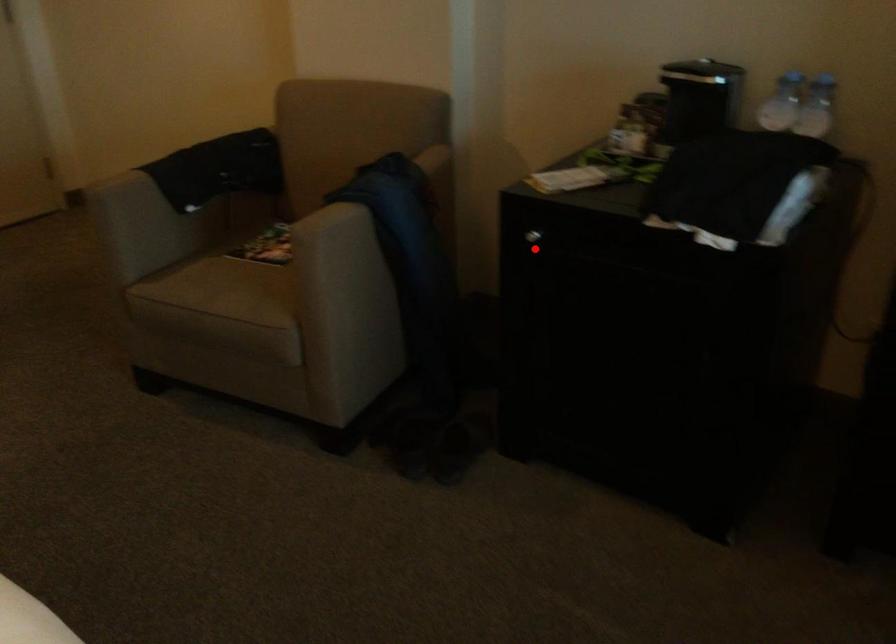
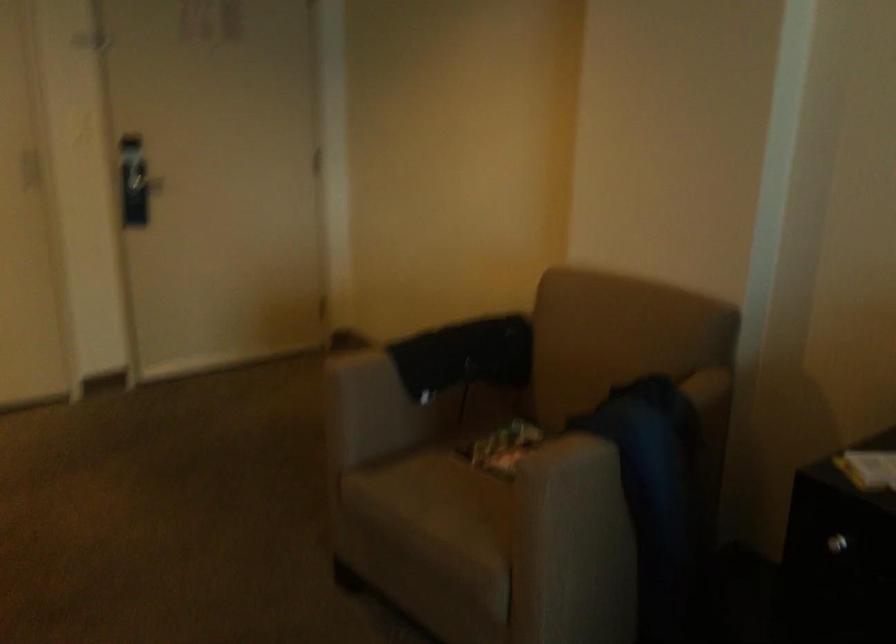
Question: I am providing you with two images of the same scene from different viewpoints. A red point is marked on the first image. Can you still see the location of the red point in image 2?

Choices:
 (A) Yes
 (B) No

Answer: (A)